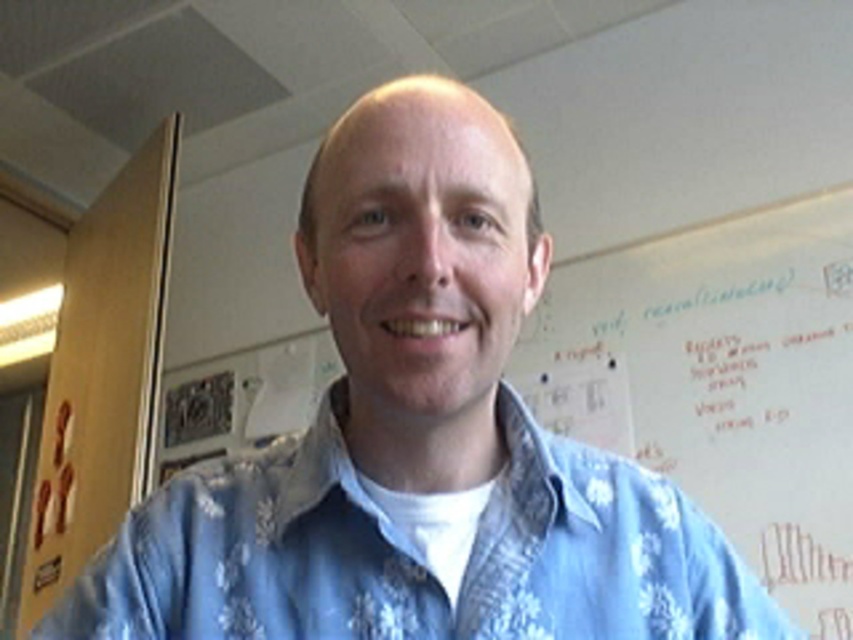
Question: Which point is closer to the camera?

Choices:
 (A) (805, 596)
 (B) (194, 588)

Answer: (B)

Question: Is blue floral shirt at center positioned before white paper at upper center?

Choices:
 (A) yes
 (B) no

Answer: (A)

Question: Does blue floral shirt at center have a greater width compared to white paper at upper center?

Choices:
 (A) yes
 (B) no

Answer: (B)

Question: Can you confirm if blue floral shirt at center is wider than white paper at upper center?

Choices:
 (A) yes
 (B) no

Answer: (B)

Question: Which point is closer to the camera?

Choices:
 (A) (376, 625)
 (B) (846, 465)

Answer: (A)

Question: Which point is closer to the camera?

Choices:
 (A) 502,499
 (B) 772,387

Answer: (A)